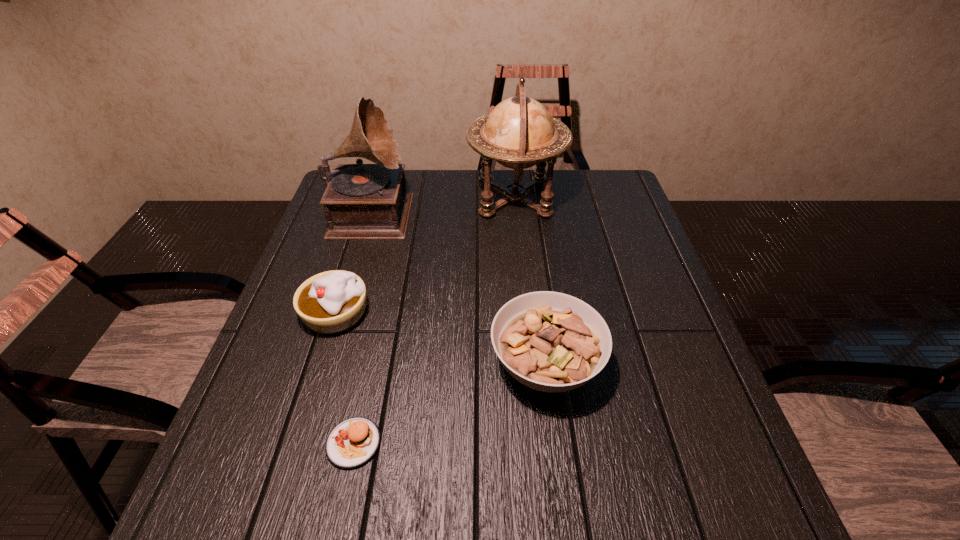
Locate an element on the screen. globe is located at coordinates (519, 132).

The width and height of the screenshot is (960, 540). I want to click on record player, so click(x=362, y=201).

I want to click on whipped cream, so click(333, 301).

Image resolution: width=960 pixels, height=540 pixels. I want to click on stew, so click(x=552, y=342).

Locate an element on the screen. This screenshot has height=540, width=960. patty is located at coordinates click(353, 442).

Where is `the nearest object`? This screenshot has width=960, height=540. the nearest object is located at coordinates (353, 442).

Where is `blank space located on the front-facing side of the globe`? The image size is (960, 540). blank space located on the front-facing side of the globe is located at coordinates (448, 199).

Where is `blank space located on the front-facing side of the globe`? Image resolution: width=960 pixels, height=540 pixels. blank space located on the front-facing side of the globe is located at coordinates (357, 199).

I want to click on free point located 0.200m on the front-facing side of the globe, so click(x=403, y=199).

Identify the location of vacant space situated 0.380m from the horn of the record player. The image size is (960, 540). (537, 210).